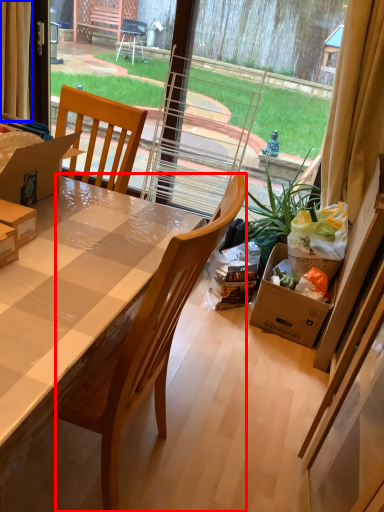
Question: Which object is closer to the camera taking this photo, chair (highlighted by a red box) or curtain (highlighted by a blue box)?

Choices:
 (A) chair
 (B) curtain

Answer: (A)